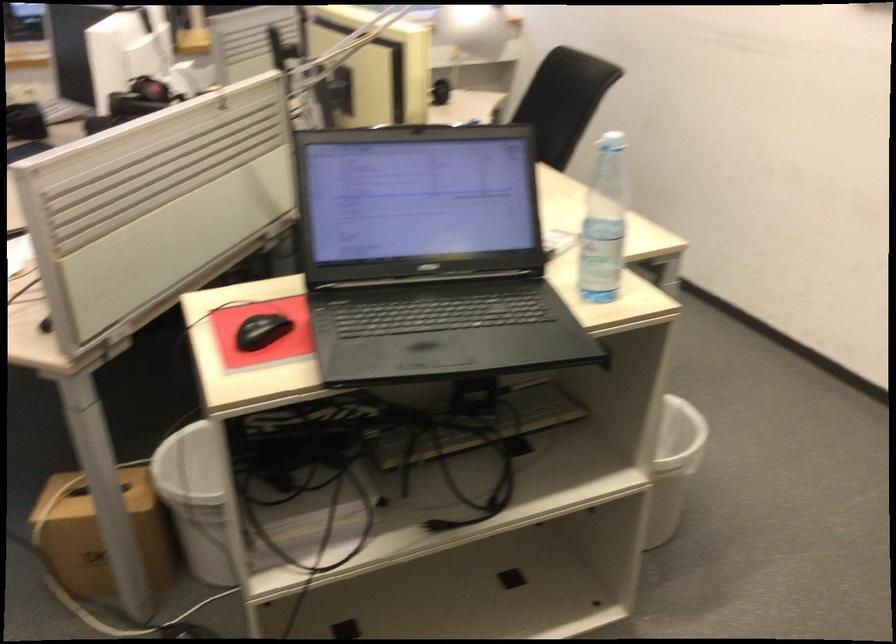
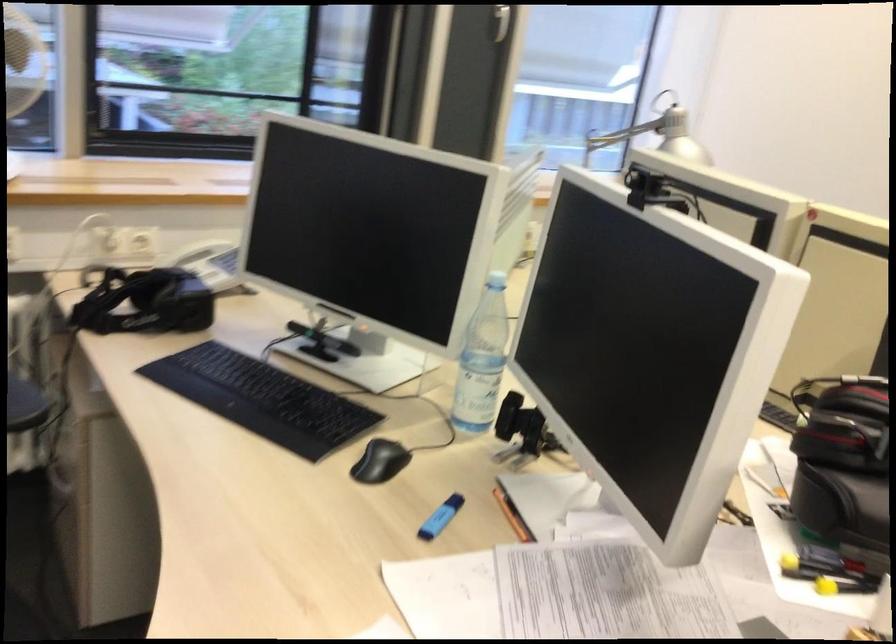
Which direction would the cameraman need to move to produce the second image?

The movement direction of the cameraman is left, forward.